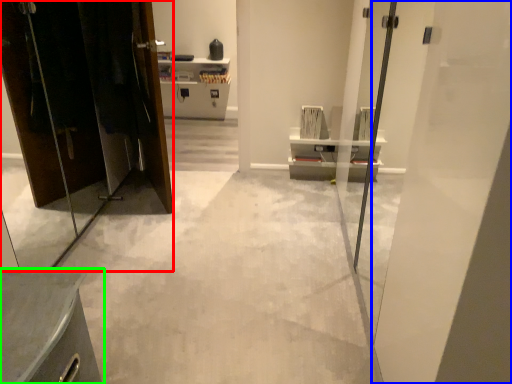
Question: Which is farther away from elevator (highlighted by a red box)? door (highlighted by a blue box) or furniture (highlighted by a green box)?

Choices:
 (A) door
 (B) furniture

Answer: (A)